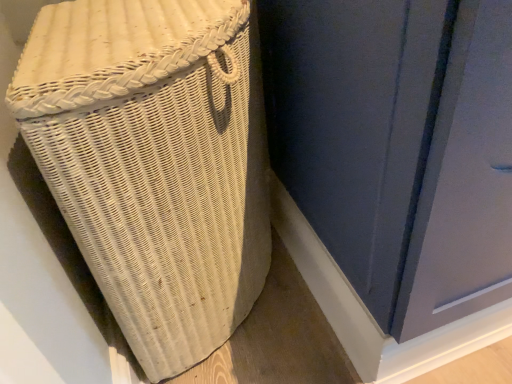
Question: From the image's perspective, is white wicker basket at left above matte blue screen door at center?

Choices:
 (A) yes
 (B) no

Answer: (B)

Question: Is white wicker basket at left to the left of matte blue screen door at center from the viewer's perspective?

Choices:
 (A) no
 (B) yes

Answer: (B)

Question: Is the depth of white wicker basket at left less than that of matte blue screen door at center?

Choices:
 (A) no
 (B) yes

Answer: (A)

Question: Is matte blue screen door at center inside white wicker basket at left?

Choices:
 (A) no
 (B) yes

Answer: (A)

Question: Is white wicker basket at left shorter than matte blue screen door at center?

Choices:
 (A) yes
 (B) no

Answer: (B)

Question: Does white wicker basket at left have a smaller size compared to matte blue screen door at center?

Choices:
 (A) yes
 (B) no

Answer: (A)

Question: From a real-world perspective, is matte blue screen door at center on white wicker basket at left?

Choices:
 (A) yes
 (B) no

Answer: (A)

Question: Can you confirm if matte blue screen door at center is shorter than white wicker basket at left?

Choices:
 (A) no
 (B) yes

Answer: (B)

Question: Are matte blue screen door at center and white wicker basket at left far apart?

Choices:
 (A) no
 (B) yes

Answer: (A)

Question: Is matte blue screen door at center further to camera compared to white wicker basket at left?

Choices:
 (A) no
 (B) yes

Answer: (A)

Question: Can you confirm if matte blue screen door at center is thinner than white wicker basket at left?

Choices:
 (A) yes
 (B) no

Answer: (B)

Question: Would you say matte blue screen door at center is outside white wicker basket at left?

Choices:
 (A) yes
 (B) no

Answer: (A)

Question: Looking at the image, does matte blue screen door at center seem bigger or smaller compared to white wicker basket at left?

Choices:
 (A) small
 (B) big

Answer: (B)